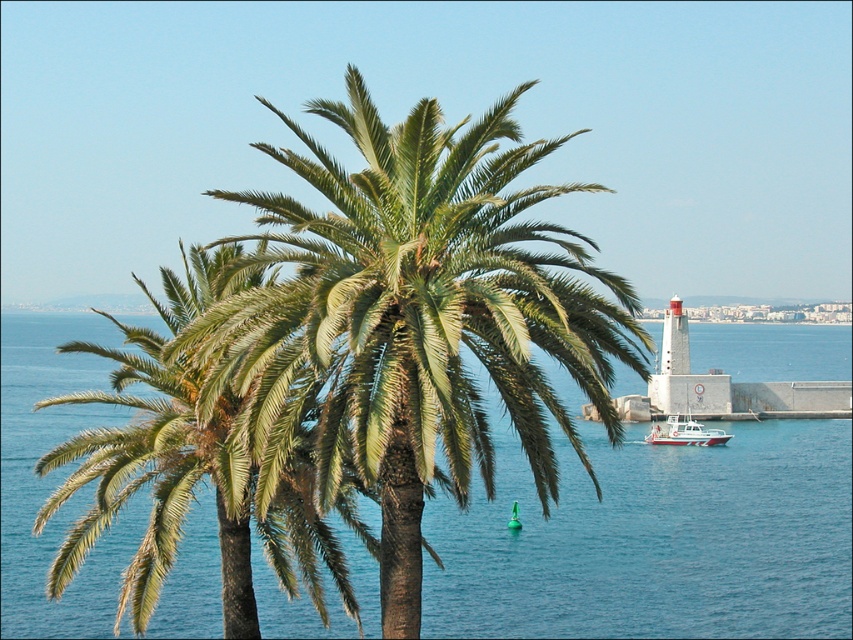
Question: Does blue water at center have a smaller size compared to white plastic boat at center-right?

Choices:
 (A) no
 (B) yes

Answer: (A)

Question: Where is green leafy palm tree at center located in relation to white plastic boat at center-right in the image?

Choices:
 (A) above
 (B) below

Answer: (A)

Question: Which point is closer to the camera?

Choices:
 (A) blue water at center
 (B) green leafy palm tree at center
 (C) white plastic boat at center-right

Answer: (B)

Question: Which point is closer to the camera?

Choices:
 (A) green leafy palm at center
 (B) green leafy palm tree at center
 (C) blue water at center

Answer: (B)

Question: Is blue water at center closer to the viewer compared to white plastic boat at center-right?

Choices:
 (A) no
 (B) yes

Answer: (B)

Question: Which point appears closest to the camera in this image?

Choices:
 (A) coord(271,586)
 (B) coord(659,436)
 (C) coord(213,413)

Answer: (C)